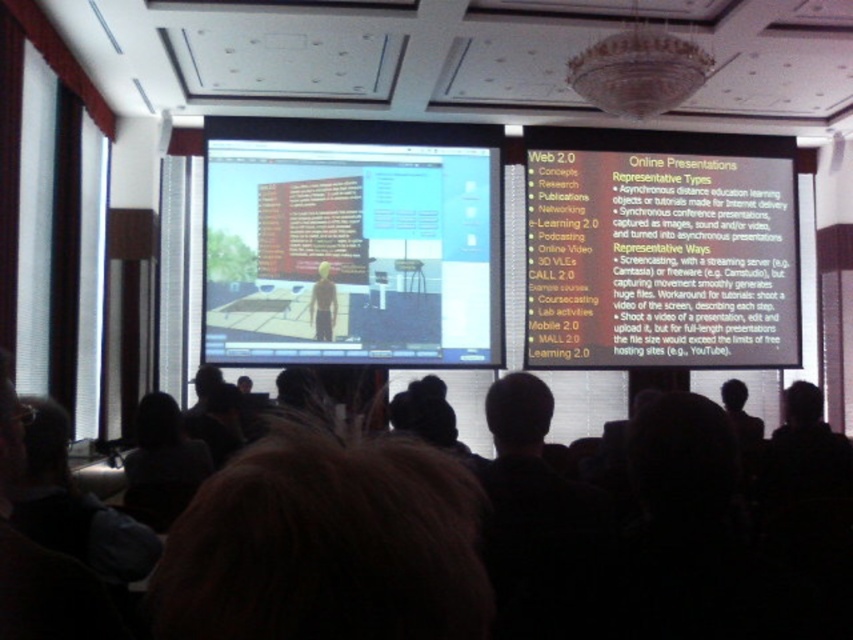
You are sitting in the conference room and looking at the projection screen. There are two points marked on the screen. The first point is at coordinates point (196,442) and the second point is at point (334,316). Which of these two points is closer to you?

The point at coordinates point (196,442) is closer to you than the point at (334,316).

You are an attendee at the presentation. You notice two items in the scene. One is a white paper at upper right and the other is a dark gray sweater at lower left. Can you determine which of these two items is wider?

The white paper at upper right might be wider than dark gray sweater at lower left.

You are an attendee at the presentation and want to see the speaker clearly. Which clothing item is closer to the front of the room between the dark gray sweater at lower left and the light brown fabric shirt at center?

The dark gray sweater at lower left is shorter than the light brown fabric shirt at center, so the dark gray sweater at lower left is closer to the front of the room.